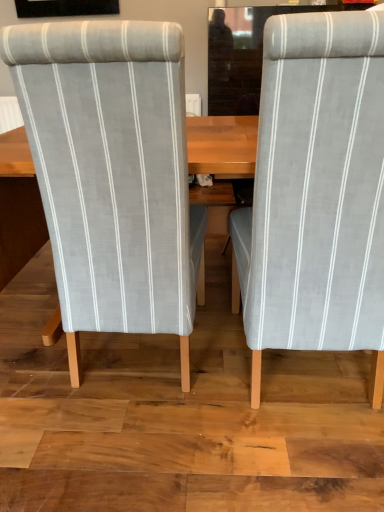
Where is `vacant space that's between light gray striped fabric chair at left, which appears as the first chair when viewed from the left, and gray fabric chair at right, which is the 1th chair in right-to-left order`? vacant space that's between light gray striped fabric chair at left, which appears as the first chair when viewed from the left, and gray fabric chair at right, which is the 1th chair in right-to-left order is located at coordinates (202, 360).